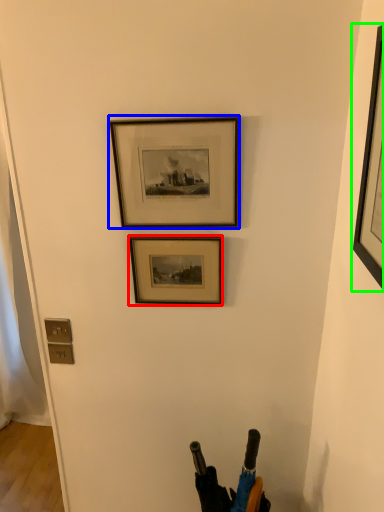
Question: Based on their relative distances, which object is nearer to picture frame (highlighted by a red box)? Choose from picture frame (highlighted by a blue box) and picture frame (highlighted by a green box).

Choices:
 (A) picture frame
 (B) picture frame

Answer: (A)